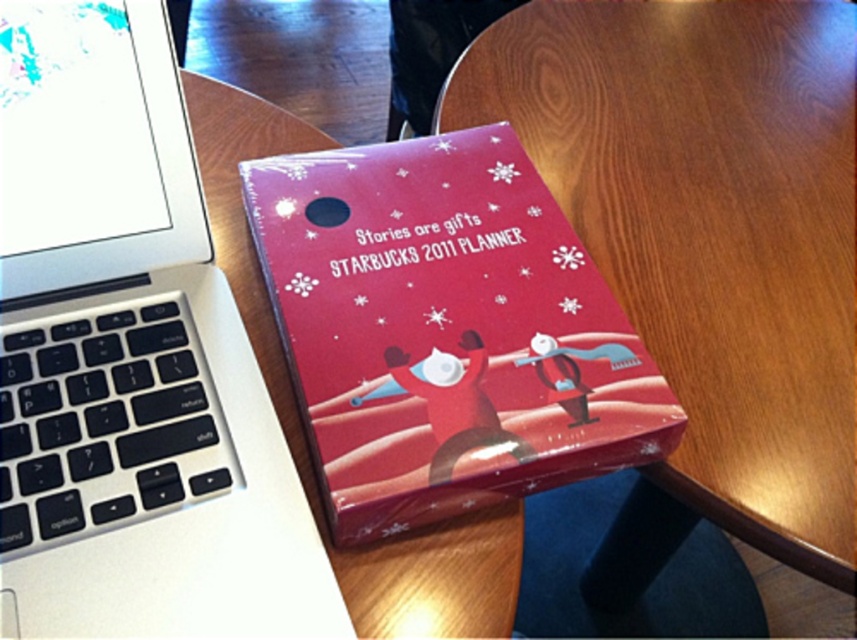
You are a delivery person who needs to place a small package on the table without covering any existing items. The package is 3 inches tall. Considering the height of the sleek silver laptop at upper left and the matte red planner at center, which item should you avoid placing the package in front of to ensure visibility?

The sleek silver laptop at upper left is taller than the matte red planner at center. To ensure visibility, you should avoid placing the package in front of the sleek silver laptop at upper left since it is taller and might block the view of the package.

You are a barista working at the STARBUCKS 2011 PLANNER event. You need to place a customer order on the wooden table. The customer ordered a hot chocolate. Where should you place the hot chocolate so it doesn not slide off the table? Consider the wooden at center and matte red planner at center in your answer.

The wooden at center is located above the matte red planner at center, so placing the hot chocolate on the wooden at center would be safer as it is higher up and less likely to slide off the table.